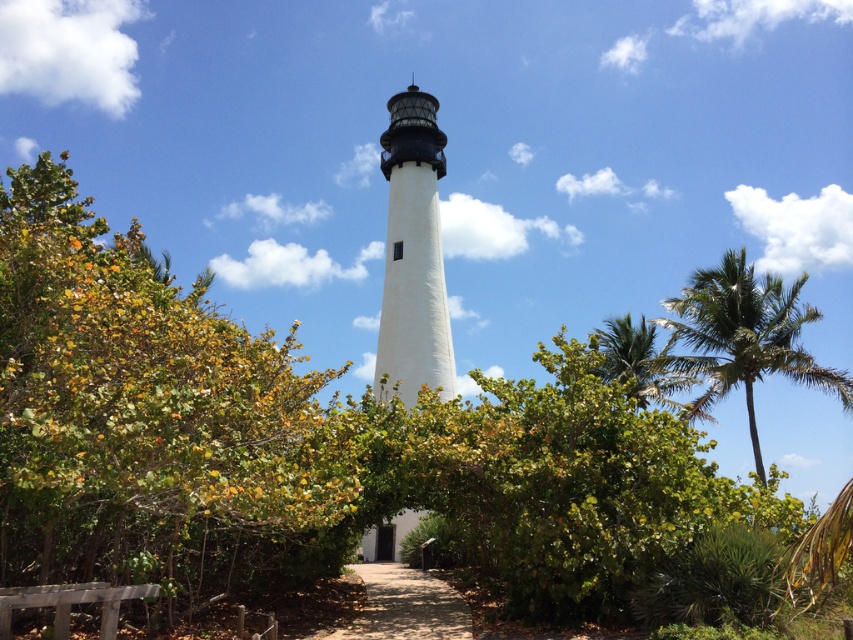
Question: Is green leafy bush at center smaller than dirt path at center?

Choices:
 (A) no
 (B) yes

Answer: (A)

Question: Which of the following is the farthest from the observer?

Choices:
 (A) green leafy palm tree at upper right
 (B) green leafy palm tree at right
 (C) dirt path at center

Answer: (B)

Question: Considering the relative positions of green leafy bush at center and white smooth lighthouse at center in the image provided, where is green leafy bush at center located with respect to white smooth lighthouse at center?

Choices:
 (A) above
 (B) below

Answer: (B)

Question: Which point appears closest to the camera in this image?

Choices:
 (A) (844, 385)
 (B) (418, 243)
 (C) (392, 592)
 (D) (215, 461)

Answer: (D)

Question: Which object is farther from the camera taking this photo?

Choices:
 (A) dirt path at center
 (B) green leafy palm tree at right
 (C) green leafy palm tree at upper right

Answer: (B)

Question: Is green leafy bush at center closer to the viewer compared to green leafy palm tree at right?

Choices:
 (A) yes
 (B) no

Answer: (A)